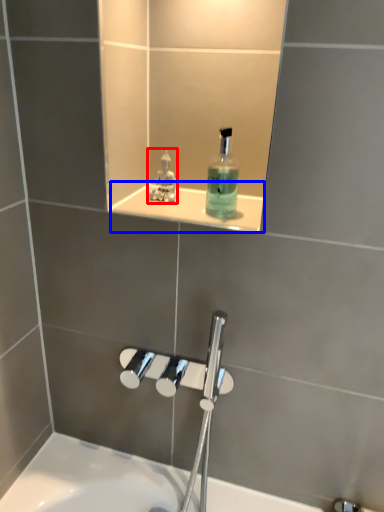
Question: Which of the following is the closest to the observer, perfume (highlighted by a red box) or ledge (highlighted by a blue box)?

Choices:
 (A) perfume
 (B) ledge

Answer: (B)